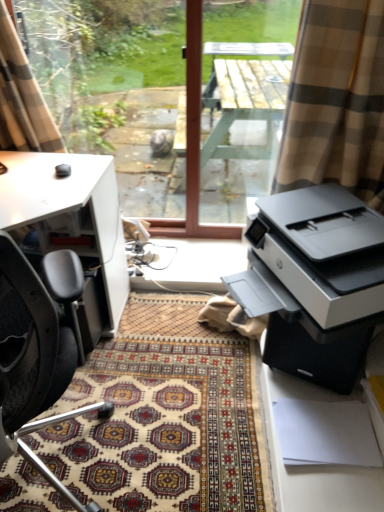
Question: From the image's perspective, is patterned carpet at center positioned above or below beige plaid curtain at upper left?

Choices:
 (A) above
 (B) below

Answer: (B)

Question: From a real-world perspective, is patterned carpet at center physically located above or below beige plaid curtain at upper left?

Choices:
 (A) above
 (B) below

Answer: (B)

Question: Estimate the real-world distances between objects in this image. Which object is closer to the black leather chair at left?

Choices:
 (A) patterned carpet at center
 (B) beige plaid curtain at upper left
 (C) transparent glass window at center
 (D) white matte desk at left
 (E) wooden table at center

Answer: (A)

Question: Considering the real-world distances, which object is farthest from the matte black printer at right?

Choices:
 (A) transparent glass window at center
 (B) patterned carpet at center
 (C) wooden table at center
 (D) black leather chair at left
 (E) beige plaid curtain at upper left

Answer: (C)